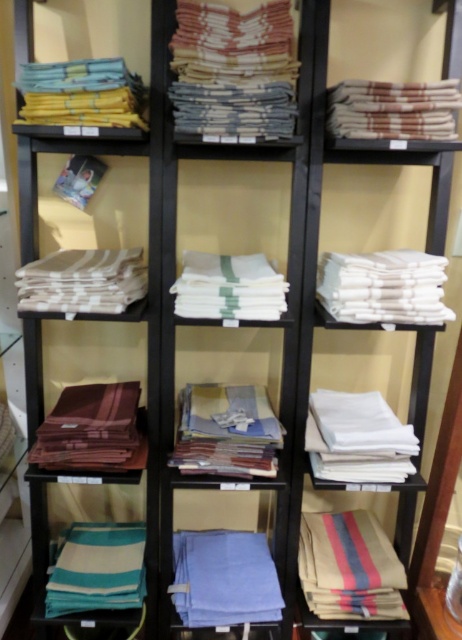
You are organizing towels in a store and need to place the white cotton towel at center and the striped cotton towel at lower left on a shelf. According to the image, which one should be placed to the right side of the other?

The white cotton towel at center should be placed to the right of the striped cotton towel at lower left as shown in the image.

You are organizing towels in a store and need to place the white cotton towel at center and the striped cotton towel at lower left on a shelf. Which one should you place first to ensure proper stacking?

You should place the white cotton towel at center first because it is taller than the striped cotton towel at lower left, allowing the shorter one to be stacked on top without overhanging.

You are a customer in a store looking at the shelving unit. You want to take a closer look at the striped cotton napkin at center. Is it placed on top of the white cotton napkin at left?

The striped cotton napkin at center is positioned over the white cotton napkin at left, so yes, it is placed on top of it.